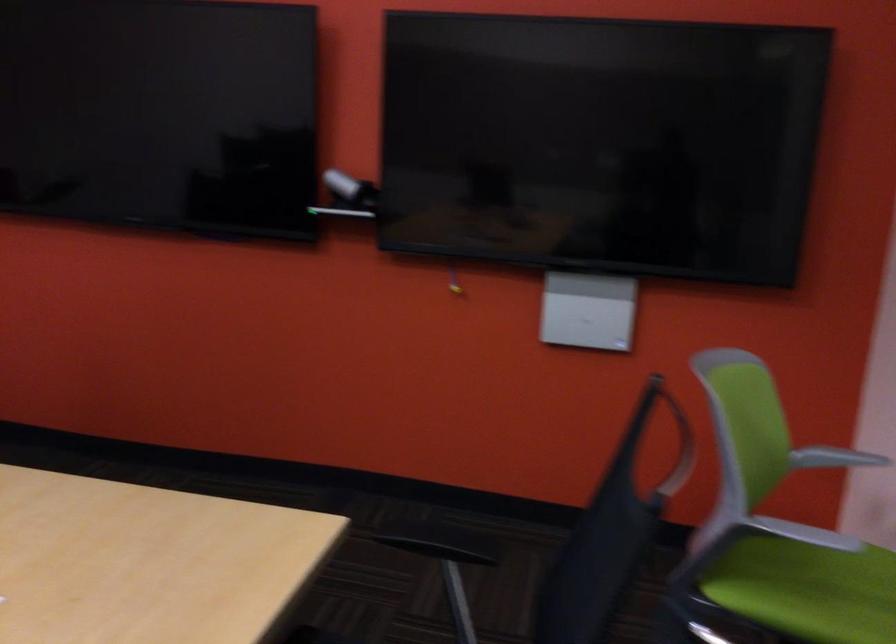
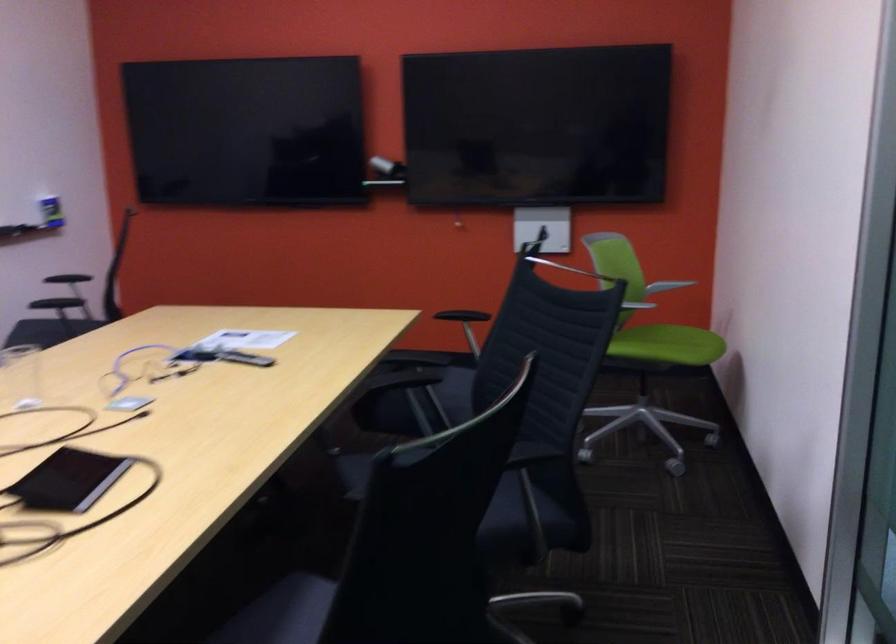
Locate, in the second image, the point that corresponds to the point at 820,468 in the first image.

(666, 286)